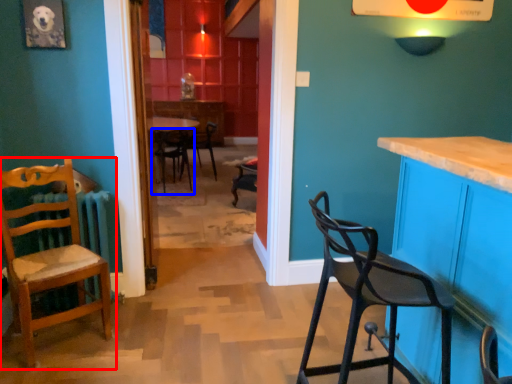
Question: Which object appears closest to the camera in this image, chair (highlighted by a red box) or chair (highlighted by a blue box)?

Choices:
 (A) chair
 (B) chair

Answer: (A)